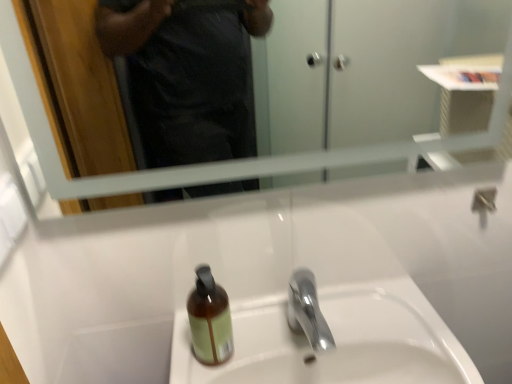
At what (x,y) coordinates should I click in order to perform the action: click on spots to the right of brown glass bottle at center. Please return your answer as a coordinate pair (x, y). The width and height of the screenshot is (512, 384). Looking at the image, I should click on (284, 335).